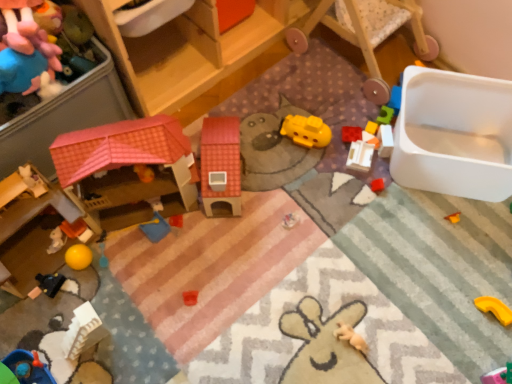
In order to click on empty space that is in between yellow rubber toy at lower right, positioned as the 11th toy in left-to-right order, and light brown plush toy at lower right, the sixth toy from the right in this screenshot , I will do `click(424, 324)`.